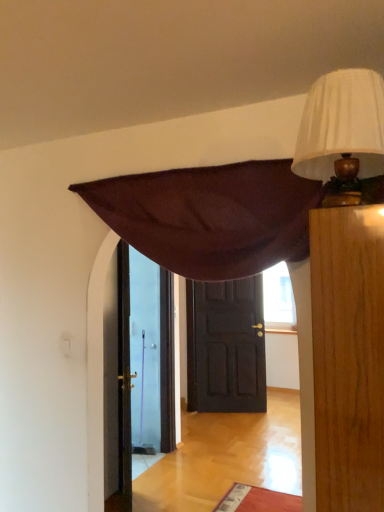
Question: From a real-world perspective, is white pleated fabric lampshade at upper right below dark brown wooden door at center?

Choices:
 (A) yes
 (B) no

Answer: (B)

Question: Can you confirm if white pleated fabric lampshade at upper right is smaller than dark brown wooden door at center?

Choices:
 (A) no
 (B) yes

Answer: (B)

Question: Is white pleated fabric lampshade at upper right directly adjacent to dark brown wooden door at center?

Choices:
 (A) yes
 (B) no

Answer: (B)

Question: Is white pleated fabric lampshade at upper right to the right of dark brown wooden door at center from the viewer's perspective?

Choices:
 (A) yes
 (B) no

Answer: (B)

Question: Is white pleated fabric lampshade at upper right looking in the opposite direction of dark brown wooden door at center?

Choices:
 (A) yes
 (B) no

Answer: (B)

Question: Is white pleated fabric lampshade at upper right positioned before dark brown wooden door at center?

Choices:
 (A) no
 (B) yes

Answer: (B)

Question: Is dark brown wooden door at center facing away from white pleated fabric lampshade at upper right?

Choices:
 (A) yes
 (B) no

Answer: (B)

Question: From the image's perspective, would you say dark brown wooden door at center is positioned over white pleated fabric lampshade at upper right?

Choices:
 (A) yes
 (B) no

Answer: (B)

Question: Is dark brown wooden door at center thinner than white pleated fabric lampshade at upper right?

Choices:
 (A) no
 (B) yes

Answer: (B)

Question: Does dark brown wooden door at center come in front of white pleated fabric lampshade at upper right?

Choices:
 (A) yes
 (B) no

Answer: (B)

Question: Considering the relative sizes of dark brown wooden door at center and white pleated fabric lampshade at upper right in the image provided, is dark brown wooden door at center wider than white pleated fabric lampshade at upper right?

Choices:
 (A) yes
 (B) no

Answer: (B)

Question: Would you say white pleated fabric lampshade at upper right is part of dark brown wooden door at center's contents?

Choices:
 (A) no
 (B) yes

Answer: (A)

Question: Is point (339, 158) positioned closer to the camera than point (226, 311)?

Choices:
 (A) farther
 (B) closer

Answer: (B)